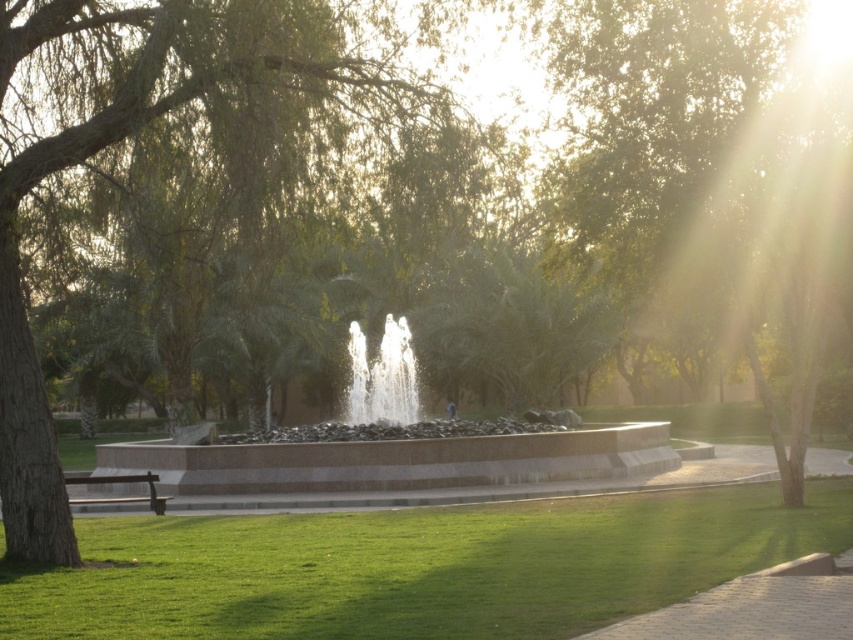
You are a photographer standing at the edge of the park scene. You want to take a photo of the clear glass water at center and the brown wooden bench at lower left. Which object should you focus on first to ensure both are in the frame?

The brown wooden bench at lower left is behind clear glass water at center, so you should focus on the clear glass water at center first to ensure both are in the frame.

You are standing in the park and want to walk from the green grass at lower center to the clear glass water at center. Which direction should you move to reach the water?

You should move to the left to reach the clear glass water at center because the green grass at lower center is to the right of it.